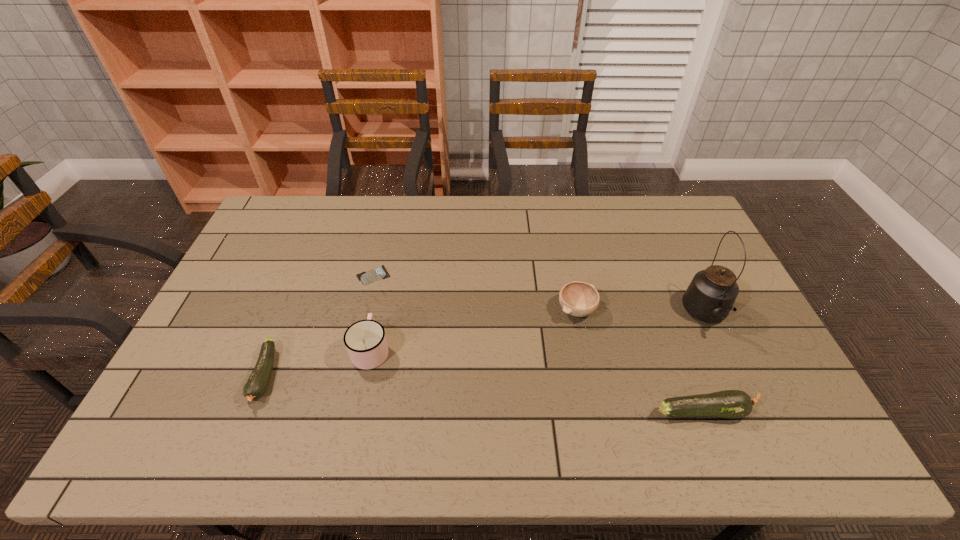
This screenshot has height=540, width=960. Find the location of `the leftmost object`. the leftmost object is located at coordinates (257, 383).

Where is `the shorter zucchini`? The width and height of the screenshot is (960, 540). the shorter zucchini is located at coordinates (257, 383).

Locate an element on the screen. the right zucchini is located at coordinates (731, 404).

At what (x,y) coordinates should I click in order to perform the action: click on the tallest object. Please return your answer as a coordinate pair (x, y). The width and height of the screenshot is (960, 540). Looking at the image, I should click on (710, 296).

This screenshot has height=540, width=960. I want to click on the shortest object, so click(x=379, y=273).

This screenshot has height=540, width=960. I want to click on identity card, so click(379, 273).

Find the location of a particular element. This screenshot has height=540, width=960. mug is located at coordinates (365, 340).

At what (x,y) coordinates should I click in order to perform the action: click on bowl. Please return your answer as a coordinate pair (x, y). The image size is (960, 540). Looking at the image, I should click on (579, 299).

This screenshot has width=960, height=540. Find the location of `vacant space situated 0.110m at the blossom end of the taller zucchini`. vacant space situated 0.110m at the blossom end of the taller zucchini is located at coordinates (798, 411).

At what (x,y) coordinates should I click in order to perform the action: click on vacant area located spout on the tallest object. Please return your answer as a coordinate pair (x, y). The height and width of the screenshot is (540, 960). Looking at the image, I should click on (733, 375).